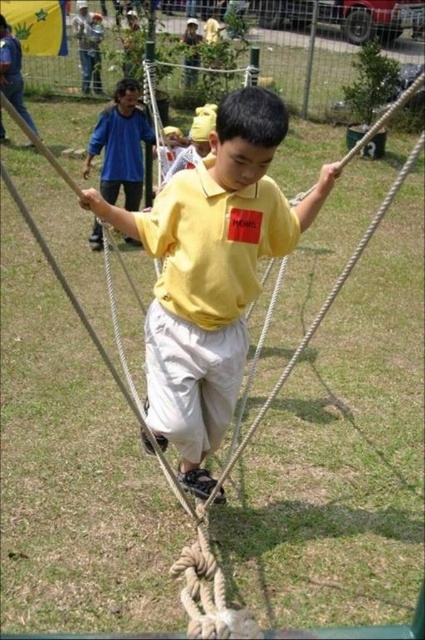
Question: Is yellow matte shirt at center positioned in front of blue cotton shirt at upper left?

Choices:
 (A) yes
 (B) no

Answer: (A)

Question: Among these objects, which one is nearest to the camera?

Choices:
 (A) blue cotton shirt at upper left
 (B) yellow matte shirt at center

Answer: (B)

Question: Among these points, which one is farthest from the camera?

Choices:
 (A) (238, 125)
 (B) (135, 120)

Answer: (B)

Question: Where is yellow matte shirt at center located in relation to blue cotton shirt at upper left in the image?

Choices:
 (A) below
 (B) above

Answer: (A)

Question: From the image, what is the correct spatial relationship of yellow matte shirt at center in relation to blue cotton shirt at upper left?

Choices:
 (A) left
 (B) right

Answer: (B)